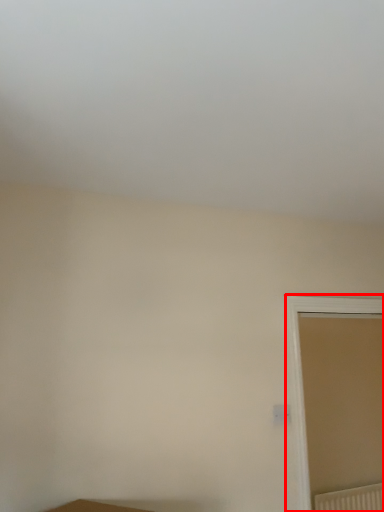
Question: From the image's perspective, what is the correct spatial positioning of window (annotated by the red box) in reference to radiator?

Choices:
 (A) above
 (B) below

Answer: (A)